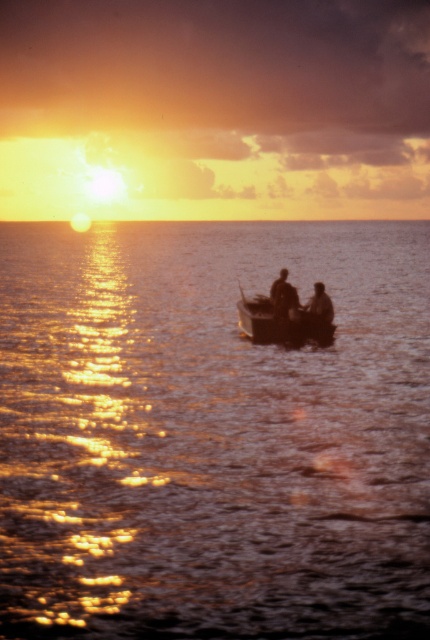
Question: Can you confirm if glistening water at center is positioned above dark brown wooden boat at center?

Choices:
 (A) no
 (B) yes

Answer: (B)

Question: Considering the real-world distances, which object is farthest from the silhouette wooden boat at center?

Choices:
 (A) smooth wooden boat at center
 (B) dark brown wooden boat at center
 (C) smooth skin face at center

Answer: (C)

Question: Is dark brown wooden boat at center thinner than smooth skin face at center?

Choices:
 (A) no
 (B) yes

Answer: (A)

Question: Which object is the closest to the dark brown wooden boat at center?

Choices:
 (A) glistening water at center
 (B) smooth wooden boat at center
 (C) smooth skin face at center

Answer: (B)

Question: Can you confirm if smooth wooden boat at center is bigger than silhouette wooden boat at center?

Choices:
 (A) yes
 (B) no

Answer: (A)

Question: Which of the following is the closest to the observer?

Choices:
 (A) smooth wooden boat at center
 (B) smooth skin face at center
 (C) glistening water at center
 (D) silhouette wooden boat at center

Answer: (C)